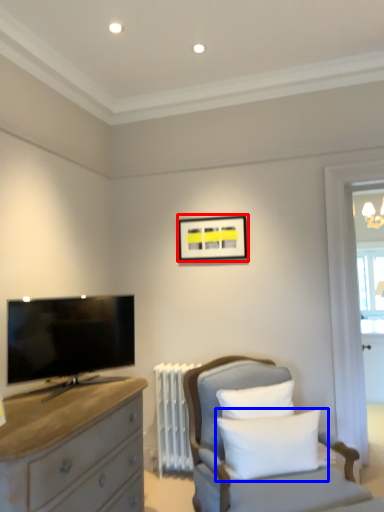
Question: Which of the following is the closest to the observer, picture frame (highlighted by a red box) or pillow (highlighted by a blue box)?

Choices:
 (A) picture frame
 (B) pillow

Answer: (B)